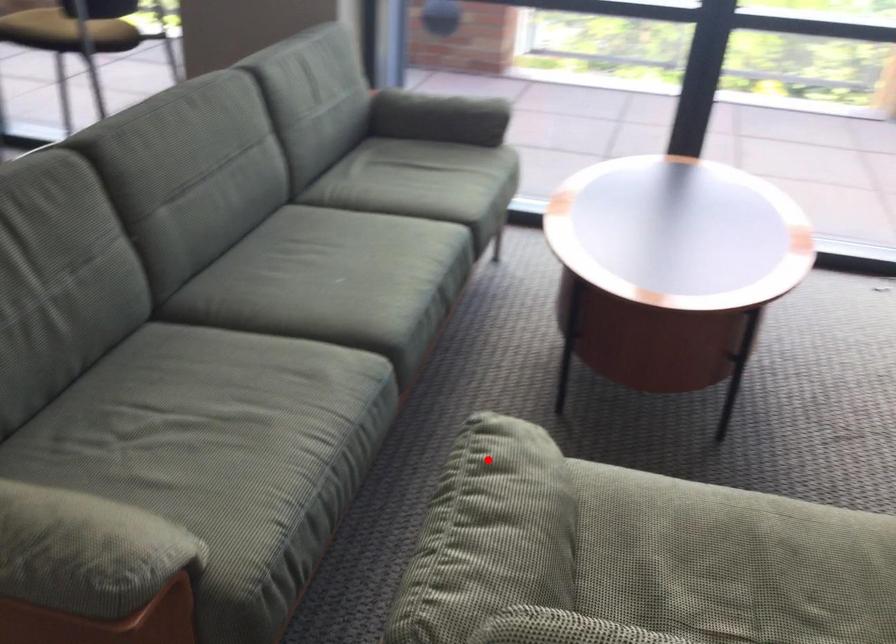
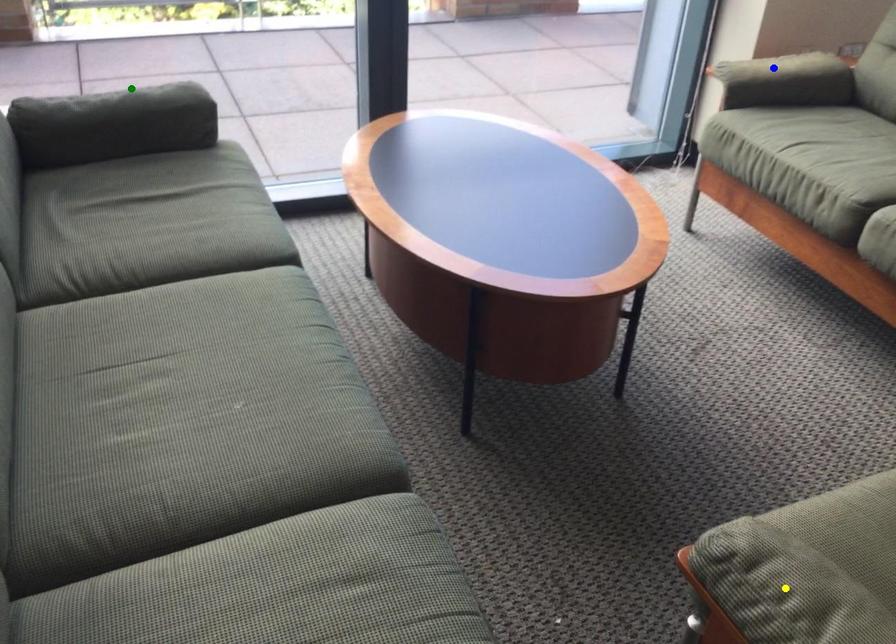
Question: I am providing you with two images of the same scene from different viewpoints. A red point is marked on the first image. You are given multiple points on the second image. Which point in image 2 represents the same 3d spot as the red point in image 1?

Choices:
 (A) green point
 (B) yellow point
 (C) blue point

Answer: (B)